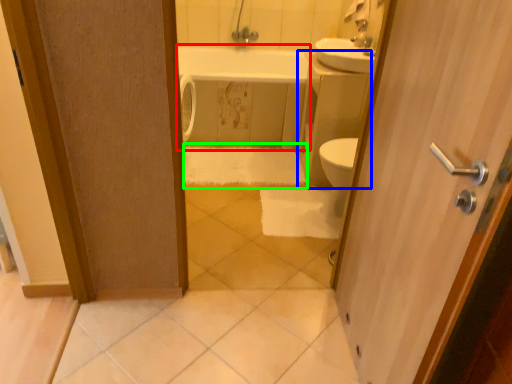
Question: Which object is positioned closest to bath (highlighted by a red box)? Select from counter top (highlighted by a blue box) and bath towel (highlighted by a green box).

Choices:
 (A) counter top
 (B) bath towel

Answer: (B)